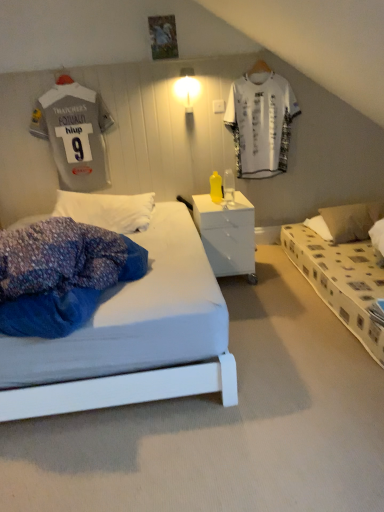
Question: In the image, is white printed t-shirt at upper center, the 2th t shirt positioned from the left, on the left side or the right side of white glossy light fixture at upper center?

Choices:
 (A) right
 (B) left

Answer: (A)

Question: From a real-world perspective, is white printed t-shirt at upper center, which is counted as the 1th t shirt, starting from the right, above or below white glossy light fixture at upper center?

Choices:
 (A) above
 (B) below

Answer: (B)

Question: Which of these objects is positioned closest to the white printed t-shirt at upper center, the 2th t shirt positioned from the left?

Choices:
 (A) white glossy light fixture at upper center
 (B) yellow plastic bottle at center
 (C) gray jersey at upper left, arranged as the 1th t shirt when viewed from the left
 (D) white plastic nightstand at center
 (E) brown fabric pillow at right

Answer: (B)

Question: Based on their relative distances, which object is farther from the gray jersey at upper left, which appears as the 2th t shirt when viewed from the right?

Choices:
 (A) white printed t-shirt at upper center, which is counted as the 1th t shirt, starting from the right
 (B) white glossy light fixture at upper center
 (C) white plastic nightstand at center
 (D) brown fabric pillow at right
 (E) yellow plastic bottle at center

Answer: (D)